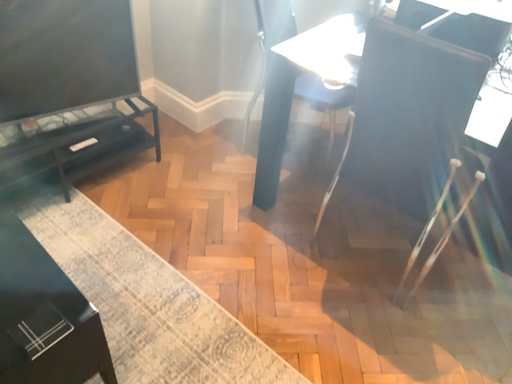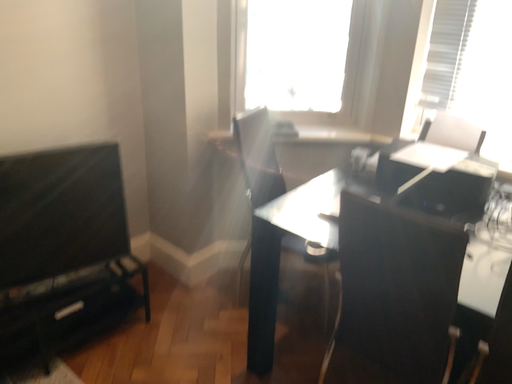
Question: Which way did the camera rotate in the video?

Choices:
 (A) rotated downward
 (B) rotated upward

Answer: (B)